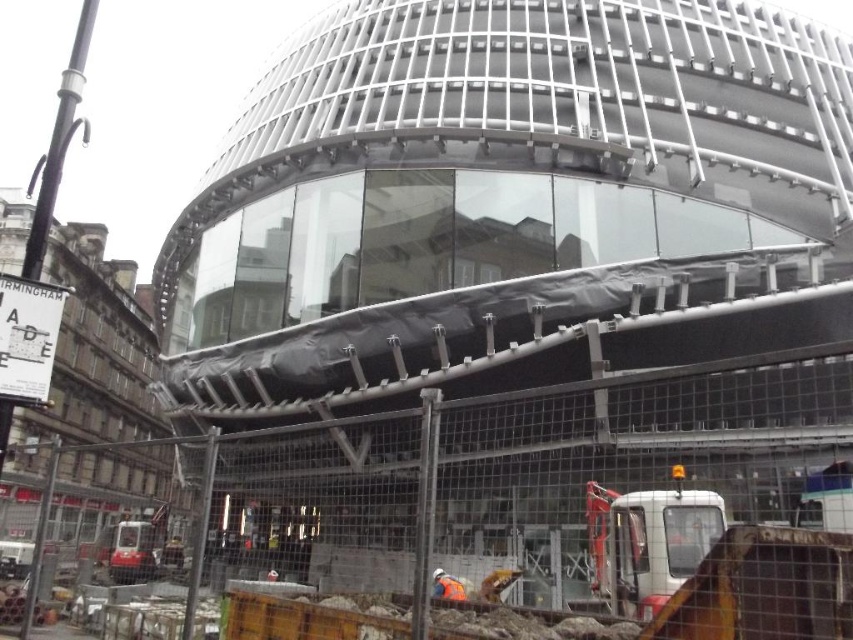
You are a construction supervisor checking the site. You need to determine if the metal mesh fence at center can be moved to allow the metallic construction vehicle at lower left to pass through. Based on their sizes, can the vehicle pass through the fence area?

The metal mesh fence at center is larger in size than the metallic construction vehicle at lower left. Therefore, the vehicle can pass through the fence area as the fence is bigger than the vehicle.

You are a construction worker standing at the camera position. You need to move the white plastic construction vehicle at lower right to a storage area located 10 meters away. Can you reach it without moving it?

The white plastic construction vehicle at lower right is 9.51 meters from the camera, so yes, you can reach it without moving it since it is within the 10 meters distance required.

A worker is standing at point A and wants to walk to point B. The coordinates of point A are at (699, 508) and point B is at 0.206, 0.179. The distance between them is 10.73 meters. The worker has a limited time and can walk up to 12 meters. Can the worker reach point B from point A within the time limit?

The distance between point A at (699, 508) and point B at 0.206, 0.179 is 10.73 meters. Since the worker can walk up to 12 meters, they can reach point B within the time limit.